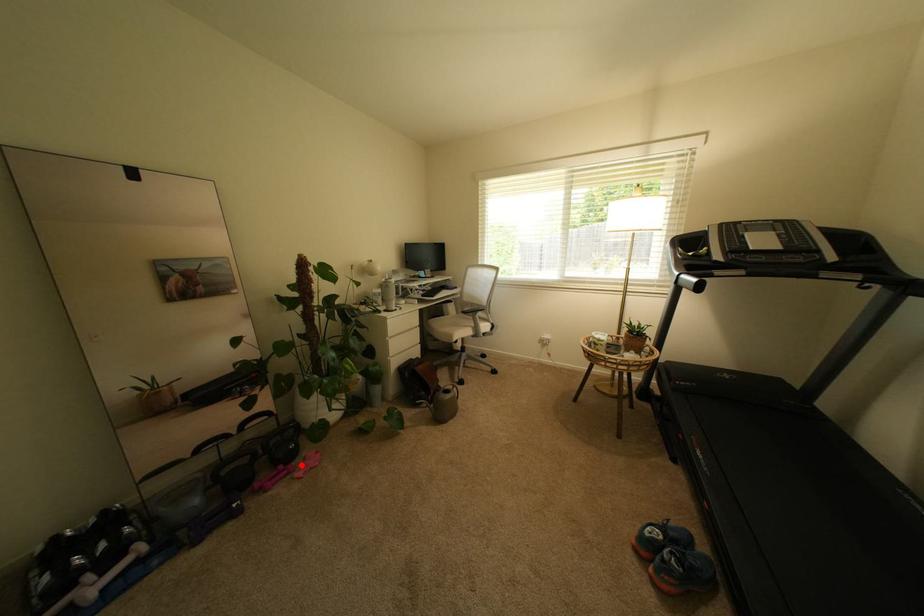
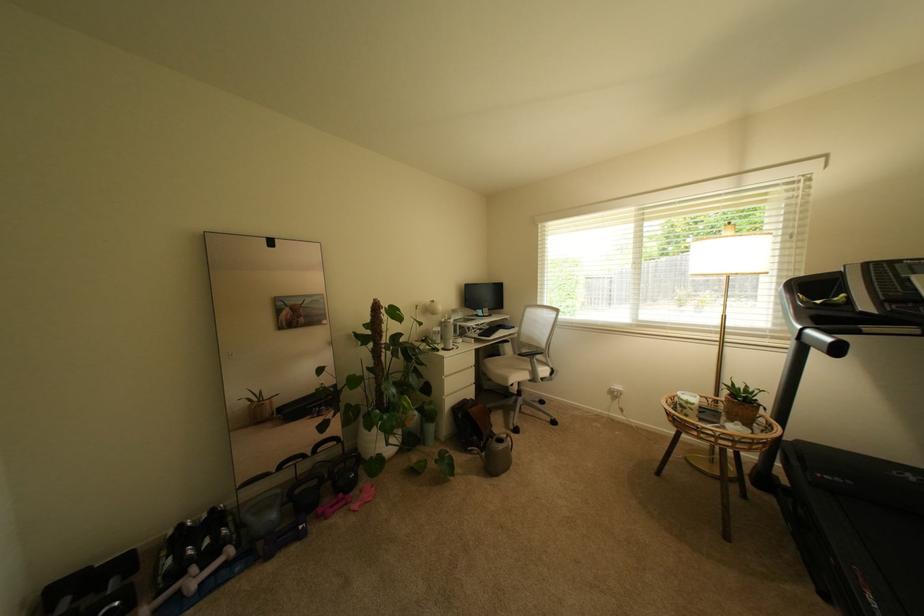
Locate, in the second image, the point that corresponds to the highlighted location in the first image.

(359, 495)